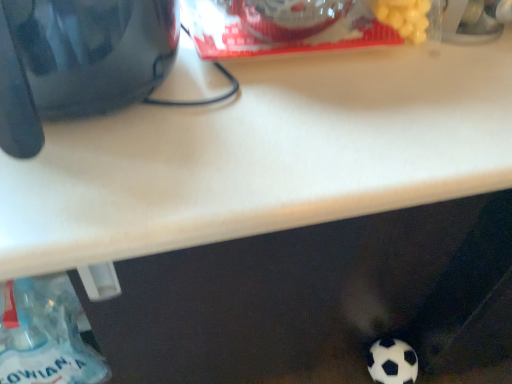
At what (x,y) coordinates should I click in order to perform the action: click on vacant space underneath glossy black kettle at upper left (from a real-world perspective). Please return your answer as a coordinate pair (x, y). Looking at the image, I should click on (105, 121).